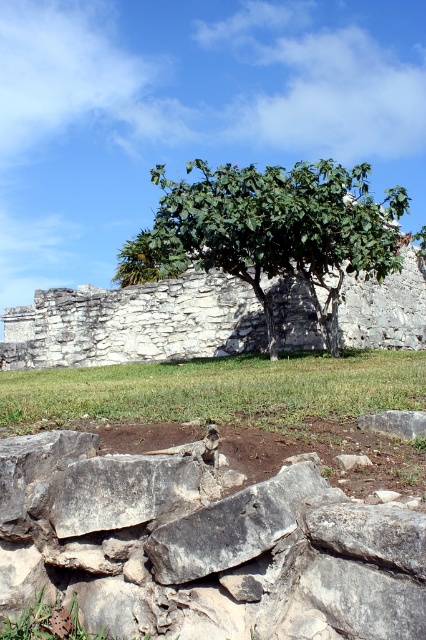
Does gray rough stone at center have a greater width compared to white stone ruins at center?

Incorrect, gray rough stone at center's width does not surpass white stone ruins at center's.

Can you confirm if gray rough stone at center is positioned to the right of white stone ruins at center?

Correct, you'll find gray rough stone at center to the right of white stone ruins at center.

Describe the element at coordinates (203, 547) in the screenshot. I see `gray rough stone at center` at that location.

Where is `gray rough stone at center`? gray rough stone at center is located at coordinates (203, 547).

Between point (22, 461) and point (271, 216), which one is positioned behind?

Point (271, 216)

Is gray rough stone at center shorter than green leafy tree at center?

Indeed, gray rough stone at center has a lesser height compared to green leafy tree at center.

Image resolution: width=426 pixels, height=640 pixels. Identify the location of gray rough stone at center. (203, 547).

What are the coordinates of `gray rough stone at center` in the screenshot? It's located at (203, 547).

Is green leafy tree at center taller than white stone ruins at center?

Correct, green leafy tree at center is much taller as white stone ruins at center.

Locate an element on the screen. green leafy tree at center is located at coordinates (271, 230).